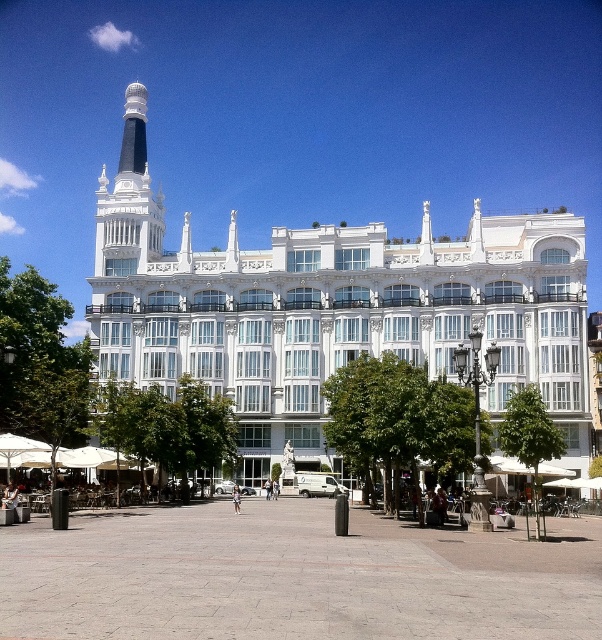
Question: Which object is closer to the camera taking this photo?

Choices:
 (A) white marble tower at upper center
 (B) white glossy building at center

Answer: (B)

Question: Which of the following is the farthest from the observer?

Choices:
 (A) white glossy building at center
 (B) white marble tower at upper center

Answer: (B)

Question: Is white glossy building at center positioned behind white marble tower at upper center?

Choices:
 (A) yes
 (B) no

Answer: (B)

Question: Does white glossy building at center have a greater width compared to white marble tower at upper center?

Choices:
 (A) no
 (B) yes

Answer: (B)

Question: Can you confirm if white glossy building at center is smaller than white marble tower at upper center?

Choices:
 (A) no
 (B) yes

Answer: (A)